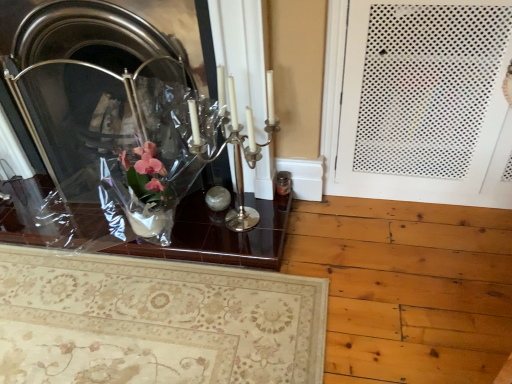
The image size is (512, 384). What do you see at coordinates (106, 116) in the screenshot?
I see `clear glass fireplace at upper left` at bounding box center [106, 116].

Identify the location of shiny glass table at center. Image resolution: width=512 pixels, height=384 pixels. (221, 236).

At what (x,y) coordinates should I click in order to perform the action: click on clear glass fireplace at upper left. Please return your answer as a coordinate pair (x, y). The image size is (512, 384). Looking at the image, I should click on (106, 116).

From the image's perspective, is shiny glass table at center beneath white perforated door at right?

Yes.

Is shiny glass table at center facing away from white perforated door at right?

No.

Between point (273, 220) and point (357, 10), which one is positioned in front?

The point (357, 10) is closer.

Is shiny glass table at center directly adjacent to white perforated door at right?

No.

Considering the relative sizes of clear glass fireplace at upper left and shiny glass table at center in the image provided, is clear glass fireplace at upper left smaller than shiny glass table at center?

No, clear glass fireplace at upper left is not smaller than shiny glass table at center.

Is clear glass fireplace at upper left in front of or behind shiny glass table at center in the image?

Clearly, clear glass fireplace at upper left is in front of shiny glass table at center.

Where is `table lying below the clear glass fireplace at upper left (from the image's perspective)`? table lying below the clear glass fireplace at upper left (from the image's perspective) is located at coordinates (221, 236).

From the image's perspective, is clear glass fireplace at upper left located above shiny glass table at center?

Yes, from the image's perspective, clear glass fireplace at upper left is over shiny glass table at center.

Considering the sizes of objects shiny glass table at center and clear glass fireplace at upper left in the image provided, who is thinner, shiny glass table at center or clear glass fireplace at upper left?

clear glass fireplace at upper left is thinner.

Does shiny glass table at center have a smaller size compared to clear glass fireplace at upper left?

Yes.

From a real-world perspective, is shiny glass table at center over clear glass fireplace at upper left?

No.

Considering the positions of point (216, 226) and point (58, 29), is point (216, 226) closer or farther from the camera than point (58, 29)?

Point (216, 226) is positioned farther from the camera compared to point (58, 29).

Which object is closer to the camera, white perforated door at right or shiny glass table at center?

Positioned in front is white perforated door at right.

Is point (508, 142) farther from viewer compared to point (281, 217)?

No, it is not.

In the scene shown: Are white perforated door at right and shiny glass table at center far apart?

No, there isn't a large distance between white perforated door at right and shiny glass table at center.

Is white perforated door at right wider than shiny glass table at center?

Incorrect, the width of white perforated door at right does not surpass that of shiny glass table at center.

Is clear glass fireplace at upper left positioned with its back to white perforated door at right?

No, clear glass fireplace at upper left's orientation is not away from white perforated door at right.

Between point (64, 161) and point (414, 53), which one is positioned in front?

The point (414, 53) is closer to the camera.

Is clear glass fireplace at upper left positioned in front of white perforated door at right?

No, it is not.

Looking at this image, from a real-world perspective, is clear glass fireplace at upper left on white perforated door at right?

Actually, clear glass fireplace at upper left is physically below white perforated door at right in the real world.

In the image, is white perforated door at right positioned in front of or behind clear glass fireplace at upper left?

Clearly, white perforated door at right is in front of clear glass fireplace at upper left.

From the image's perspective, is white perforated door at right located above or below clear glass fireplace at upper left?

white perforated door at right is situated higher than clear glass fireplace at upper left in the image.

Can you confirm if white perforated door at right is smaller than clear glass fireplace at upper left?

No.

Which is more to the left, white perforated door at right or clear glass fireplace at upper left?

clear glass fireplace at upper left is more to the left.

You are a GUI agent. You are given a task and a screenshot of the screen. Output one action in this format:
    pyautogui.click(x=<x>, y=<y>)
    Task: Click on the table to the left of white perforated door at right
    
    Given the screenshot: What is the action you would take?
    pyautogui.click(x=221, y=236)

At what (x,y) coordinates should I click in order to perform the action: click on fireplace that is in front of the shiny glass table at center. Please return your answer as a coordinate pair (x, y). The image size is (512, 384). Looking at the image, I should click on (106, 116).

Based on their spatial positions, is shiny glass table at center or white perforated door at right further from clear glass fireplace at upper left?

Based on the image, white perforated door at right appears to be further to clear glass fireplace at upper left.

Estimate the real-world distances between objects in this image. Which object is closer to clear glass fireplace at upper left, white perforated door at right or shiny glass table at center?

shiny glass table at center.

From the image, which object appears to be nearer to shiny glass table at center, white perforated door at right or clear glass fireplace at upper left?

The object closer to shiny glass table at center is clear glass fireplace at upper left.

When comparing their distances from shiny glass table at center, does clear glass fireplace at upper left or white perforated door at right seem further?

The object further to shiny glass table at center is white perforated door at right.

From the image, which object appears to be farther from white perforated door at right, shiny glass table at center or clear glass fireplace at upper left?

Among the two, clear glass fireplace at upper left is located further to white perforated door at right.

Based on their spatial positions, is clear glass fireplace at upper left or shiny glass table at center closer to white perforated door at right?

shiny glass table at center lies closer to white perforated door at right than the other object.

Find the location of `fireplace located between shiny glass table at center and white perforated door at right in the left-right direction`. fireplace located between shiny glass table at center and white perforated door at right in the left-right direction is located at coordinates (106, 116).